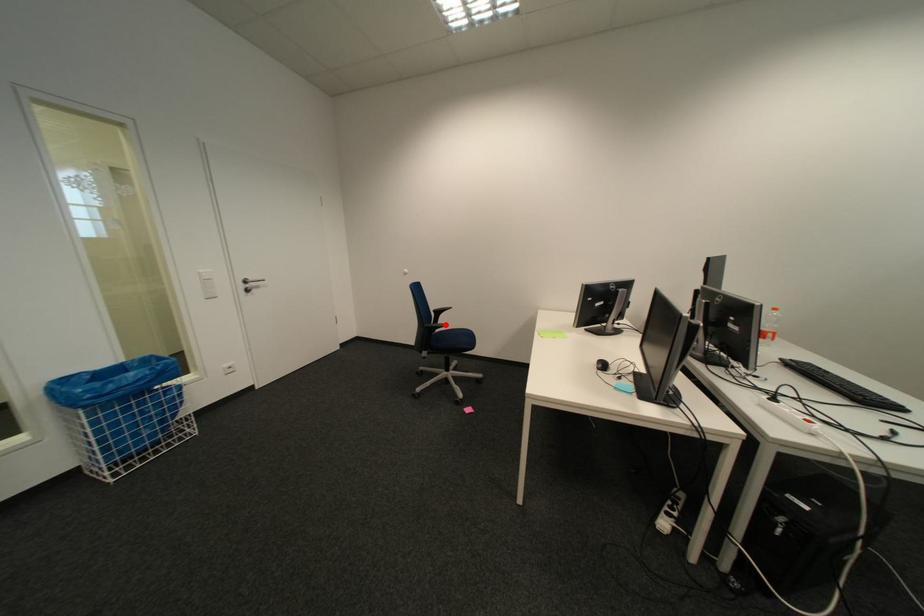
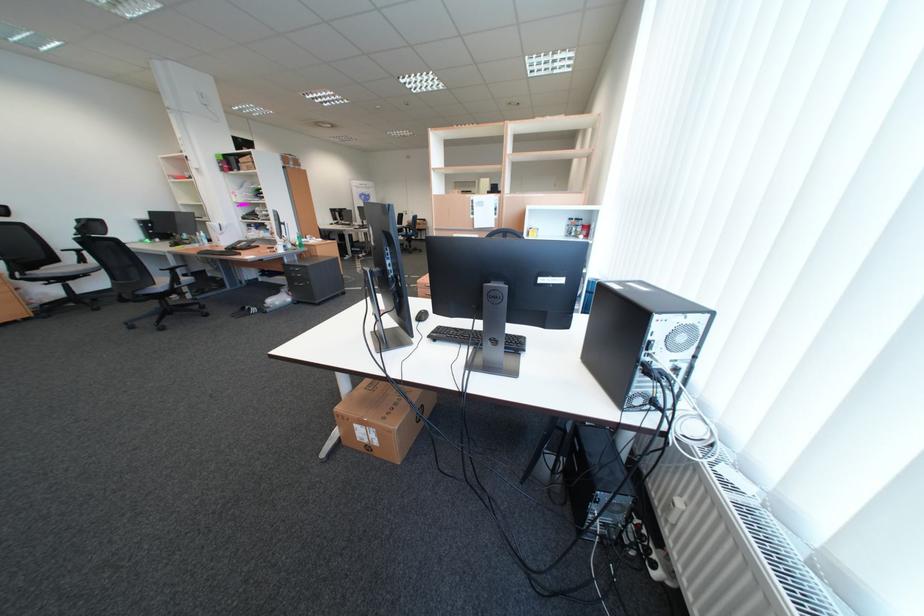
Question: I am providing you with two images of the same scene from different viewpoints. A red point is marked on the first image. Is the red point's position out of view in image 2?

Choices:
 (A) Yes
 (B) No

Answer: (A)